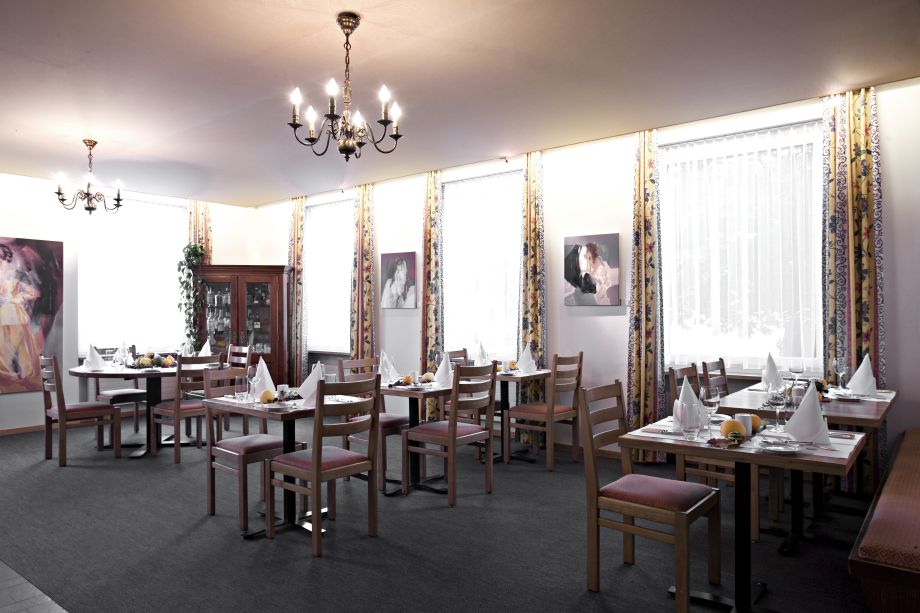
I want to click on seats of chairs, so click(236, 446), click(284, 460), click(86, 413), click(119, 395), click(159, 402), click(428, 430), click(393, 417), click(530, 409), click(647, 482).